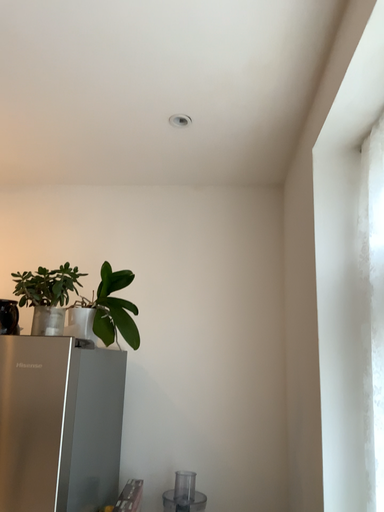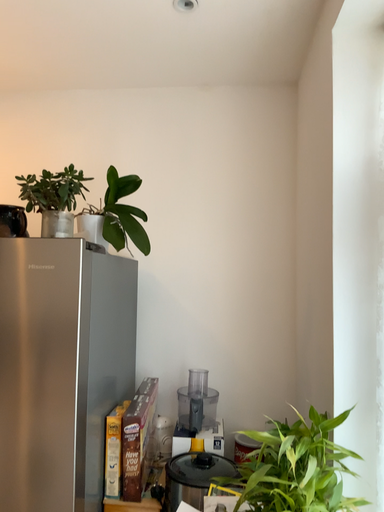
Question: How did the camera likely rotate when shooting the video?

Choices:
 (A) rotated upward
 (B) rotated downward

Answer: (B)